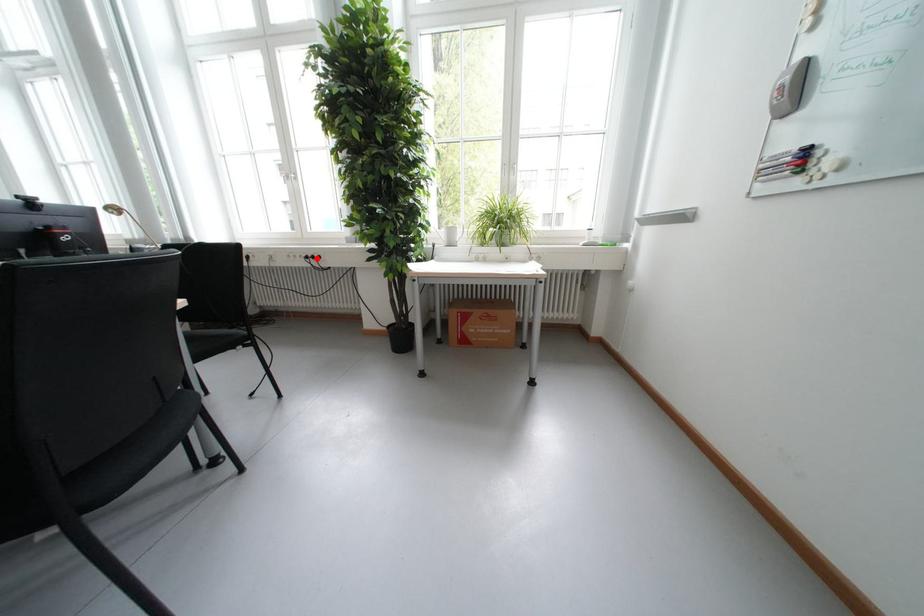
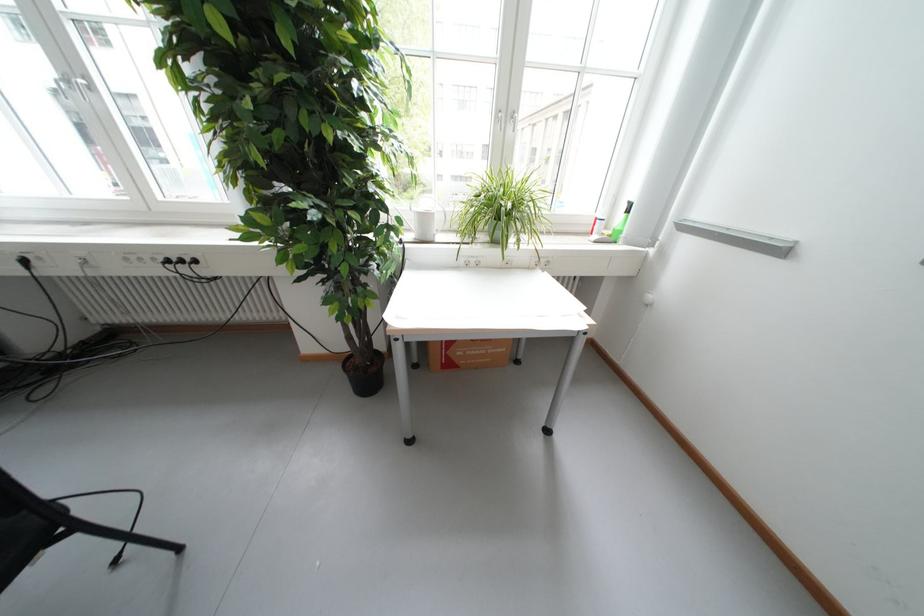
Question: I am providing you with two images of the same scene from different viewpoints. Image1 has a red point marked. In image2, the corresponding 3D location appears at what relative position? Reply with the corresponding letter.

Choices:
 (A) Closer
 (B) Farther

Answer: (B)